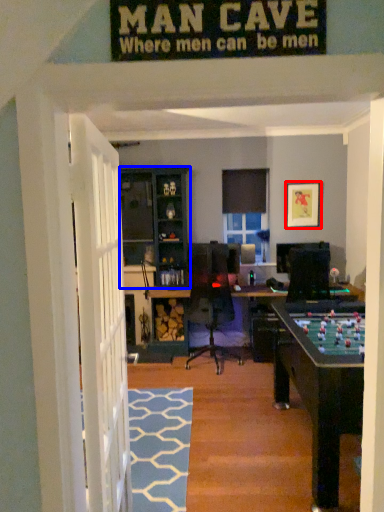
Question: Which point is further to the camera, picture frame (highlighted by a red box) or cabinetry (highlighted by a blue box)?

Choices:
 (A) picture frame
 (B) cabinetry

Answer: (A)